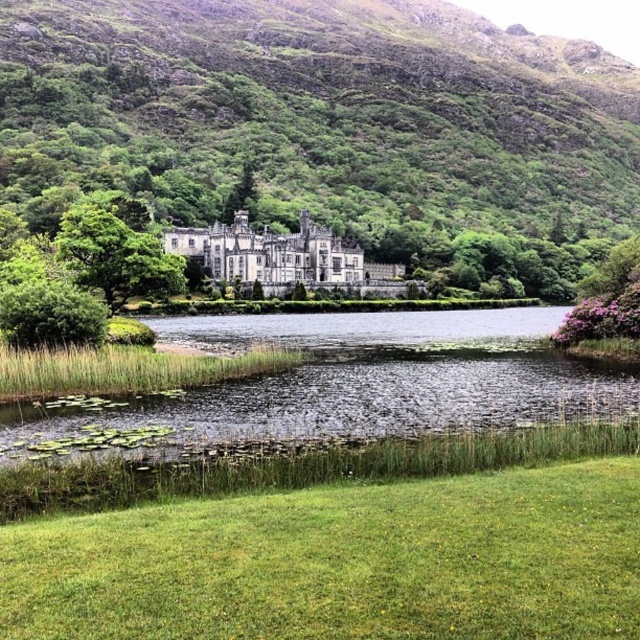
Question: Considering the real-world distances, which object is farthest from the stone castle at center?

Choices:
 (A) green leafy tree at center
 (B) green leafy hillside at upper center

Answer: (B)

Question: Is stone castle at center below green leafy tree at center?

Choices:
 (A) no
 (B) yes

Answer: (B)

Question: Which point is farther to the camera?

Choices:
 (A) (305, 170)
 (B) (65, 230)

Answer: (A)

Question: Is the position of green leafy hillside at upper center less distant than that of stone castle at center?

Choices:
 (A) no
 (B) yes

Answer: (A)

Question: In this image, where is green leafy hillside at upper center located relative to green leafy tree at center?

Choices:
 (A) above
 (B) below

Answer: (A)

Question: Which point is farther from the camera taking this photo?

Choices:
 (A) coord(97,234)
 (B) coord(193,241)
 (C) coord(454,67)

Answer: (C)